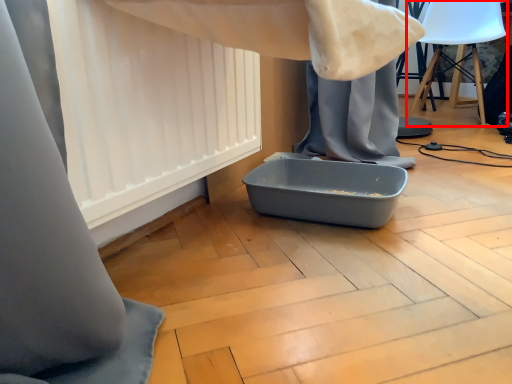
Question: From the image, what is the correct spatial relationship of swivel chair (annotated by the red box) in relation to curtain?

Choices:
 (A) left
 (B) right

Answer: (B)